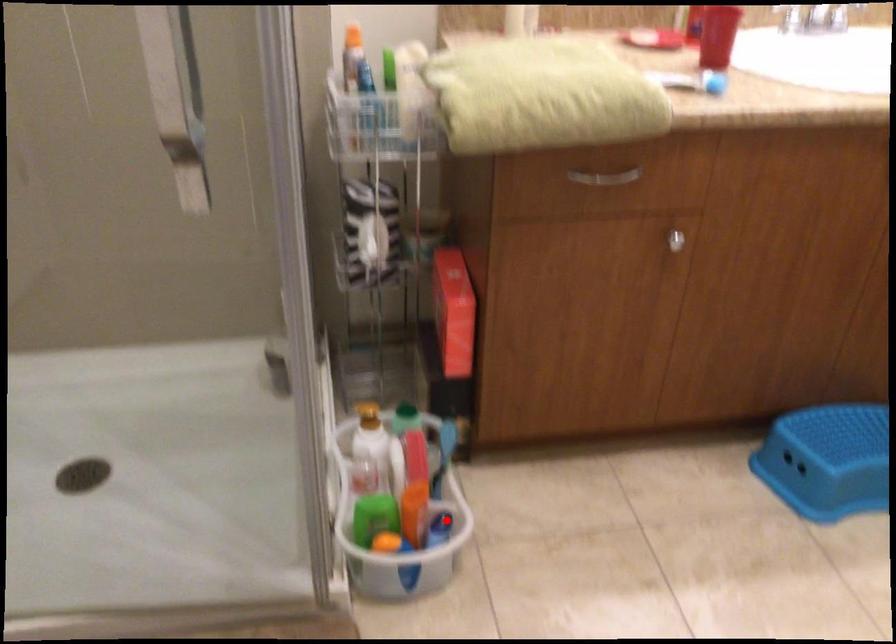
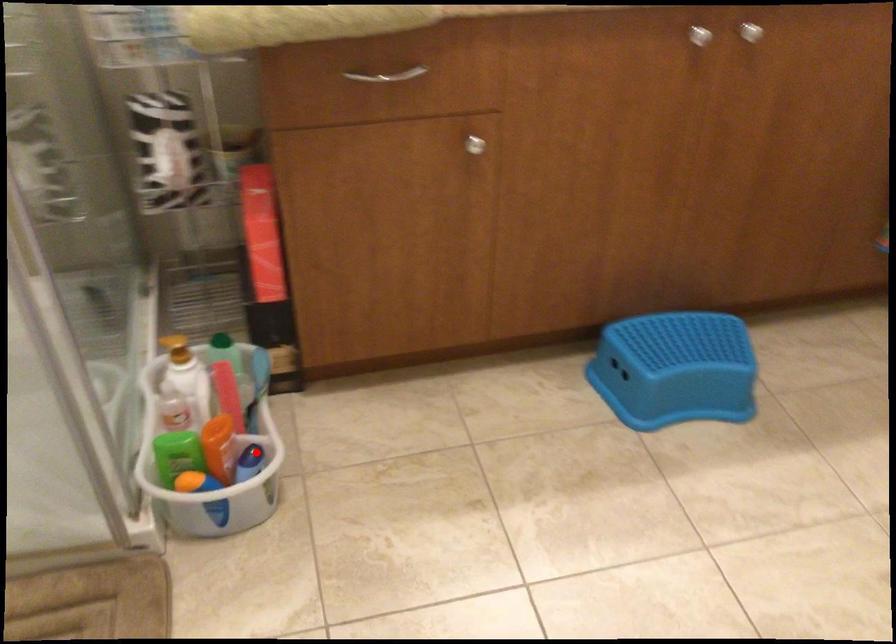
I am providing you with two images of the same scene from different viewpoints. A red point is marked on the first image and another point is marked on the second image. Are the points marked in image1 and image2 representing the same 3D position?

Yes